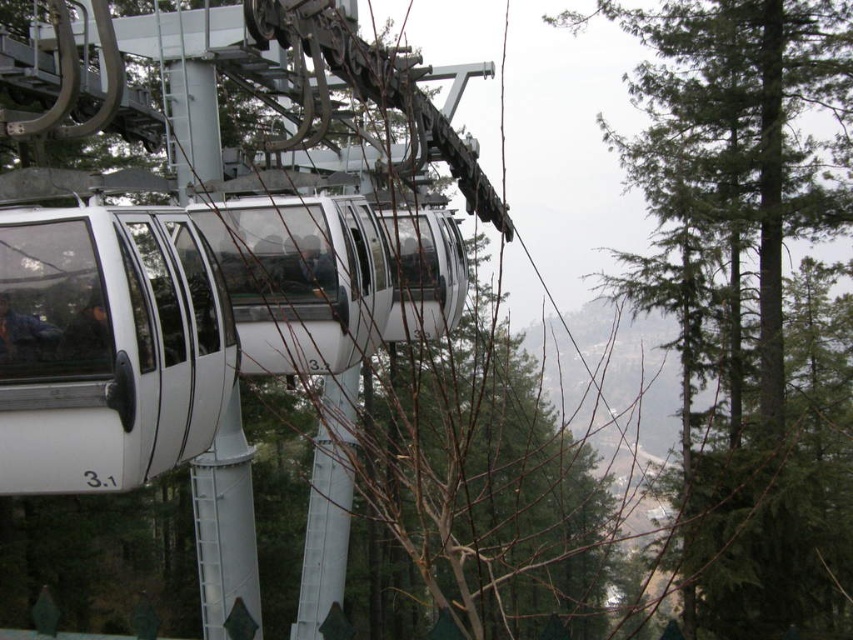
Question: Does green textured tree at upper right have a larger size compared to bare branches at center?

Choices:
 (A) yes
 (B) no

Answer: (B)

Question: Which is nearer to the white glossy cable car at center?

Choices:
 (A) green textured tree at upper right
 (B) bare branches at center

Answer: (A)

Question: Can you confirm if green textured tree at upper right is thinner than bare branches at center?

Choices:
 (A) yes
 (B) no

Answer: (A)

Question: Which point is farther to the camera?

Choices:
 (A) green textured tree at upper right
 (B) white glossy cable car at center

Answer: (B)

Question: Which object is farther from the camera taking this photo?

Choices:
 (A) white glossy cable car at center
 (B) green textured tree at upper right
 (C) bare branches at center

Answer: (A)

Question: Does green textured tree at upper right appear over bare branches at center?

Choices:
 (A) no
 (B) yes

Answer: (B)